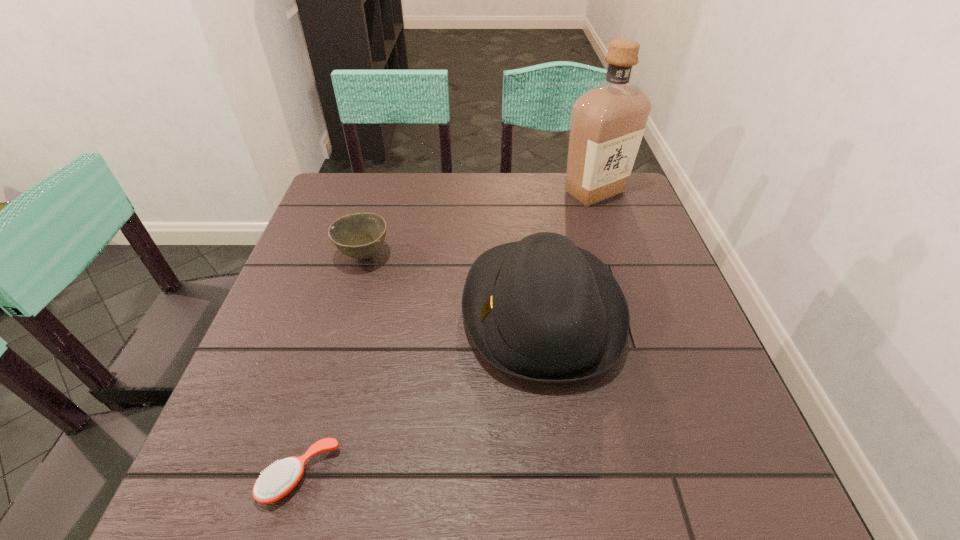
At what (x,y) coordinates should I click in order to perform the action: click on the tallest object. Please return your answer as a coordinate pair (x, y). This screenshot has width=960, height=540. Looking at the image, I should click on click(608, 121).

Find the location of `the farthest object`. the farthest object is located at coordinates (608, 121).

Identify the location of the third shortest object. This screenshot has width=960, height=540. (541, 309).

Where is `the second shortest object`? the second shortest object is located at coordinates (360, 235).

Where is `hairbrush`? This screenshot has height=540, width=960. hairbrush is located at coordinates (278, 480).

Locate an element on the screen. the nearest object is located at coordinates (278, 480).

At what (x,y) coordinates should I click in order to perform the action: click on vacant space located 0.290m on the front-facing side of the farthest object. Please return your answer as a coordinate pair (x, y). Looking at the image, I should click on (626, 287).

You are a GUI agent. You are given a task and a screenshot of the screen. Output one action in this format:
    pyautogui.click(x=<x>, y=<y>)
    Task: Click on the vacant space located 0.400m on the front-facing side of the second tallest object
    Image resolution: width=960 pixels, height=540 pixels.
    Given the screenshot: What is the action you would take?
    (x=272, y=311)

Where is `free space located on the front-facing side of the second tallest object`? free space located on the front-facing side of the second tallest object is located at coordinates (272, 311).

At what (x,y) coordinates should I click in order to perform the action: click on free space located on the front-facing side of the second tallest object. Please return your answer as a coordinate pair (x, y). The image size is (960, 540). Looking at the image, I should click on (376, 311).